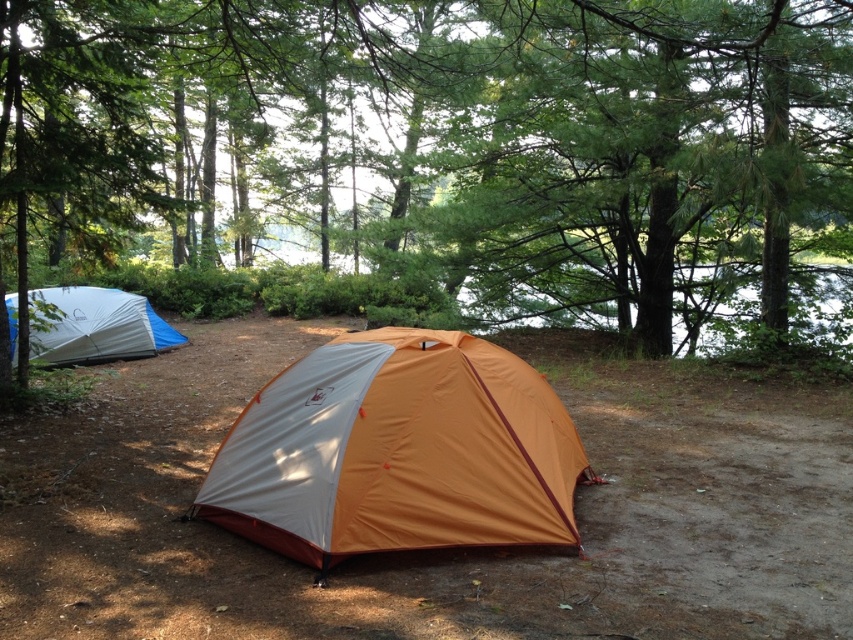
Question: Estimate the real-world distances between objects in this image. Which object is closer to the blue tarp tent at left?

Choices:
 (A) green leafy tree at center
 (B) orange nylon tent at center

Answer: (B)

Question: Is green leafy tree at center closer to camera compared to orange nylon tent at center?

Choices:
 (A) yes
 (B) no

Answer: (B)

Question: Estimate the real-world distances between objects in this image. Which object is closer to the blue tarp tent at left?

Choices:
 (A) green leafy tree at center
 (B) orange nylon tent at center

Answer: (B)

Question: Which of these objects is positioned closest to the blue tarp tent at left?

Choices:
 (A) green leafy tree at center
 (B) orange nylon tent at center

Answer: (B)

Question: Is green leafy tree at center bigger than blue tarp tent at left?

Choices:
 (A) yes
 (B) no

Answer: (A)

Question: Observing the image, what is the correct spatial positioning of green leafy tree at center in reference to blue tarp tent at left?

Choices:
 (A) above
 (B) below

Answer: (A)